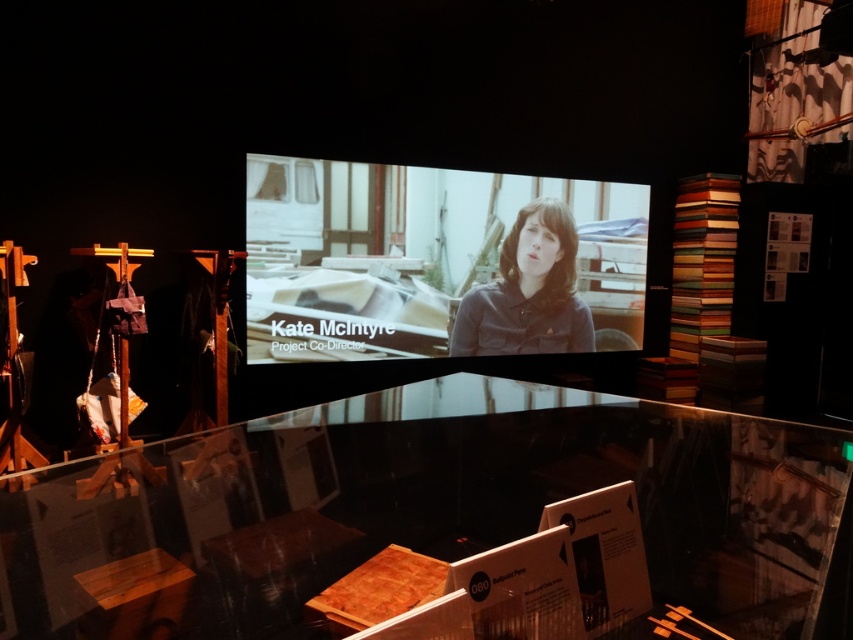
Question: Which of the following is the closest to the observer?

Choices:
 (A) matte brown shirt at center
 (B) transparent glass table at center
 (C) matte black screen at center

Answer: (B)

Question: Is matte black screen at center to the right of matte brown shirt at center from the viewer's perspective?

Choices:
 (A) no
 (B) yes

Answer: (A)

Question: Observing the image, what is the correct spatial positioning of matte black screen at center in reference to matte brown shirt at center?

Choices:
 (A) left
 (B) right

Answer: (A)

Question: Is transparent glass table at center closer to camera compared to matte black screen at center?

Choices:
 (A) no
 (B) yes

Answer: (B)

Question: Among these points, which one is nearest to the camera?

Choices:
 (A) (364, 348)
 (B) (457, 308)

Answer: (A)

Question: Estimate the real-world distances between objects in this image. Which object is closer to the matte brown shirt at center?

Choices:
 (A) transparent glass table at center
 (B) matte black screen at center

Answer: (B)